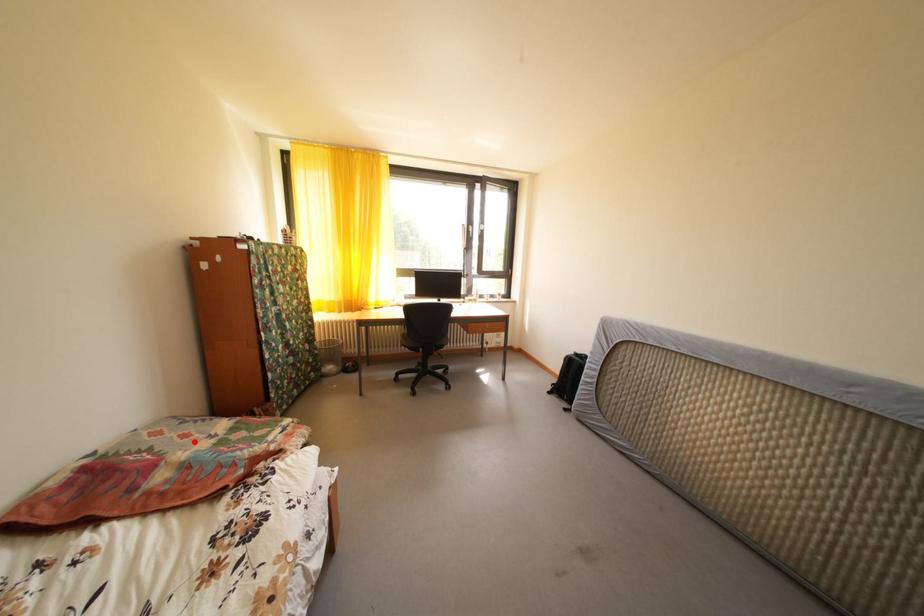
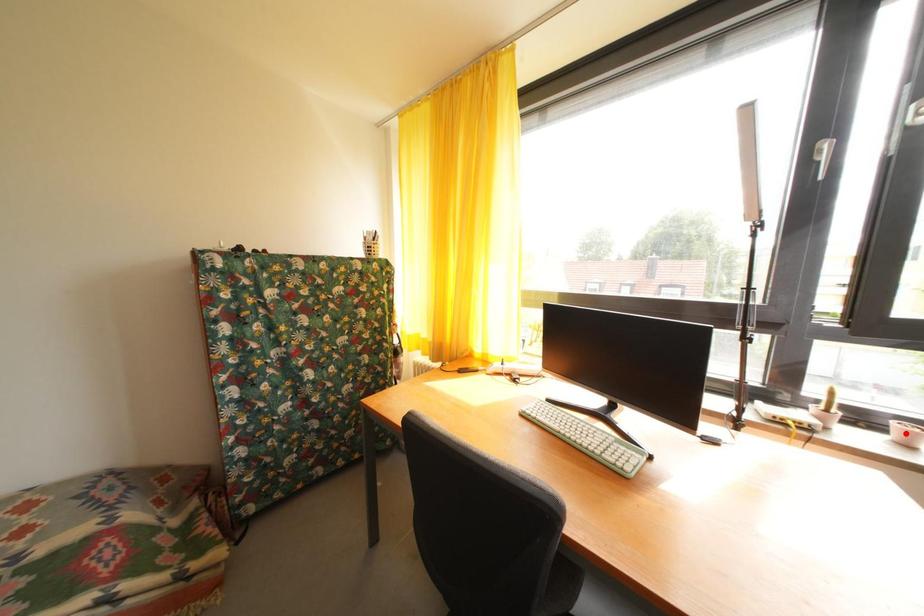
I am providing you with two images of the same scene from different viewpoints. A red point is marked on the first image and another point is marked on the second image. Does the point marked in image1 correspond to the same location as the one in image2?

No